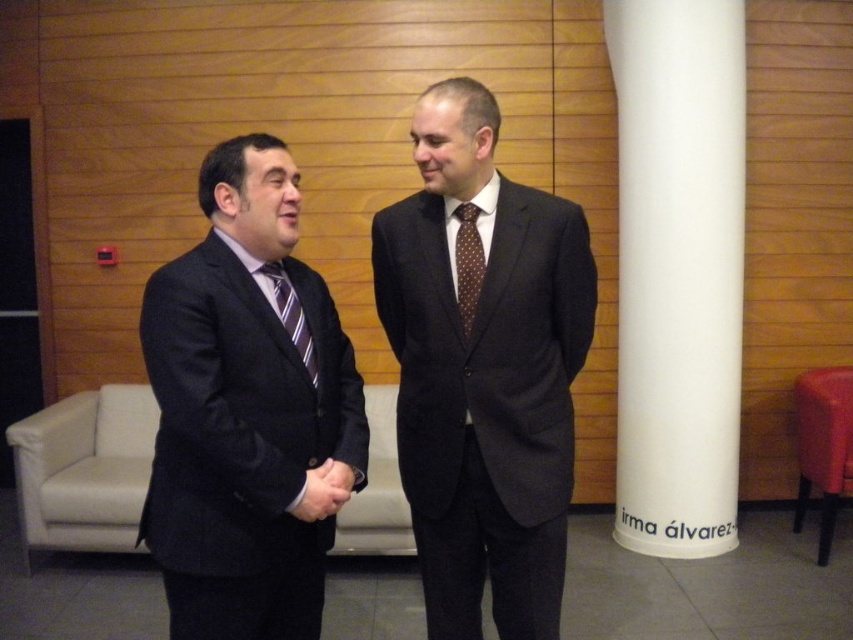
Question: Does matte black suit at center have a greater width compared to white smooth pillar at right?

Choices:
 (A) yes
 (B) no

Answer: (B)

Question: Estimate the real-world distances between objects in this image. Which object is closer to the white smooth pillar at right?

Choices:
 (A) dark gray suit at center
 (B) matte black suit at center
 (C) brown dotted tie at center
 (D) striped silk tie at center

Answer: (A)

Question: Which object is the farthest from the striped silk tie at center?

Choices:
 (A) matte black suit at center
 (B) dark gray suit at center
 (C) brown dotted tie at center

Answer: (B)

Question: Which point is farther to the camera?

Choices:
 (A) (460, 289)
 (B) (627, 410)
 (C) (294, 477)
 (D) (276, 282)

Answer: (B)

Question: Is brown dotted tie at center thinner than striped silk tie at center?

Choices:
 (A) no
 (B) yes

Answer: (B)

Question: Is dark gray suit at center to the left of matte black suit at center from the viewer's perspective?

Choices:
 (A) yes
 (B) no

Answer: (B)